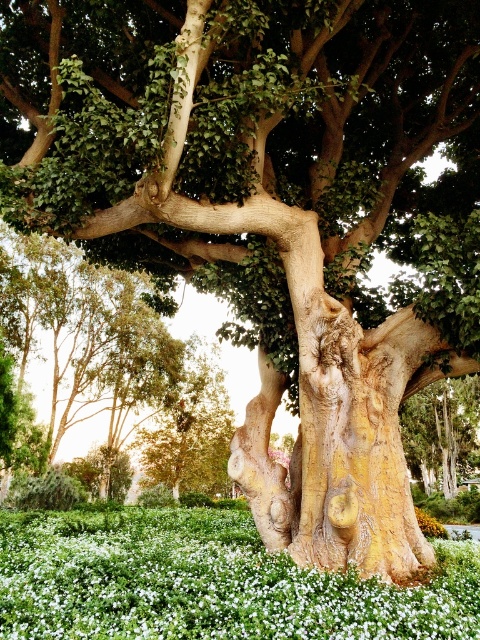
From the picture: Can you confirm if white matte flower at center is positioned to the right of yellow matte flower at center?

In fact, white matte flower at center is to the left of yellow matte flower at center.

Which is in front, point (471, 573) or point (441, 534)?

Point (471, 573)

Who is more distant from viewer, [80,624] or [419,508]?

Point [419,508]

Where is `white matte flower at center`? The image size is (480, 640). white matte flower at center is located at coordinates (207, 582).